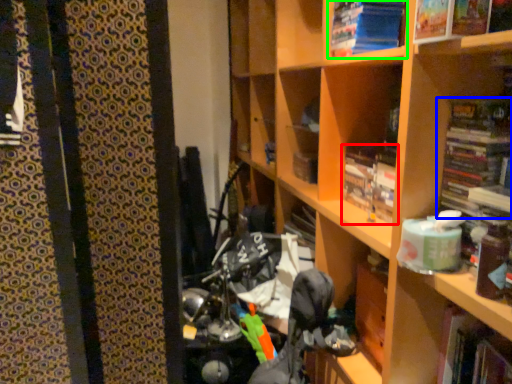
Question: Based on their relative distances, which object is nearer to book (highlighted by a red box)? Choose from book (highlighted by a blue box) and book (highlighted by a green box).

Choices:
 (A) book
 (B) book

Answer: (A)